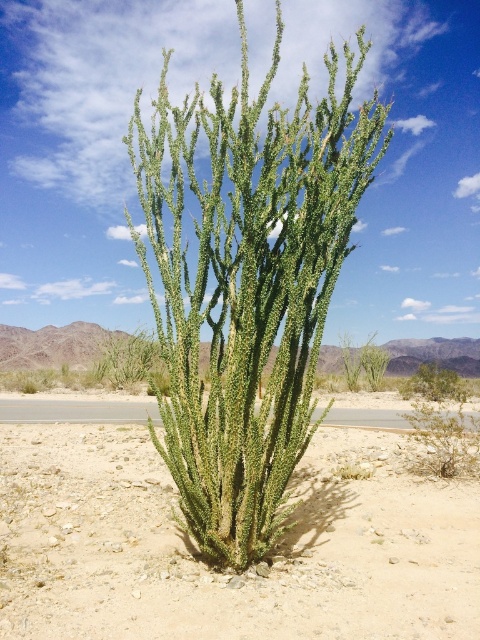
Question: Does light brown gravel at center have a larger size compared to green spiny cactus at center?

Choices:
 (A) yes
 (B) no

Answer: (B)

Question: Is light brown gravel at center positioned behind green spiny cactus at center?

Choices:
 (A) yes
 (B) no

Answer: (B)

Question: Which point is closer to the camera?

Choices:
 (A) (214, 173)
 (B) (155, 486)

Answer: (A)

Question: Which object is closer to the camera taking this photo?

Choices:
 (A) green spiny cactus at center
 (B) light brown gravel at center

Answer: (B)

Question: Does light brown gravel at center come behind green spiny cactus at center?

Choices:
 (A) no
 (B) yes

Answer: (A)